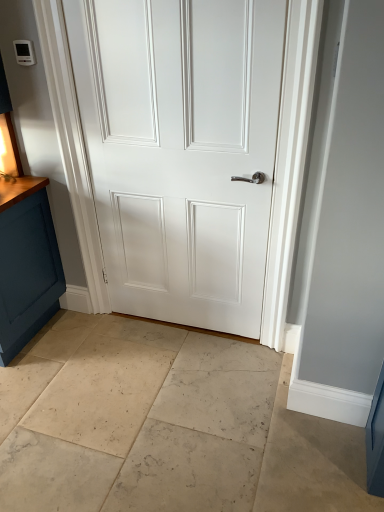
Locate an element on the screen. This screenshot has width=384, height=512. blank area to the left of white matte door at center is located at coordinates (92, 350).